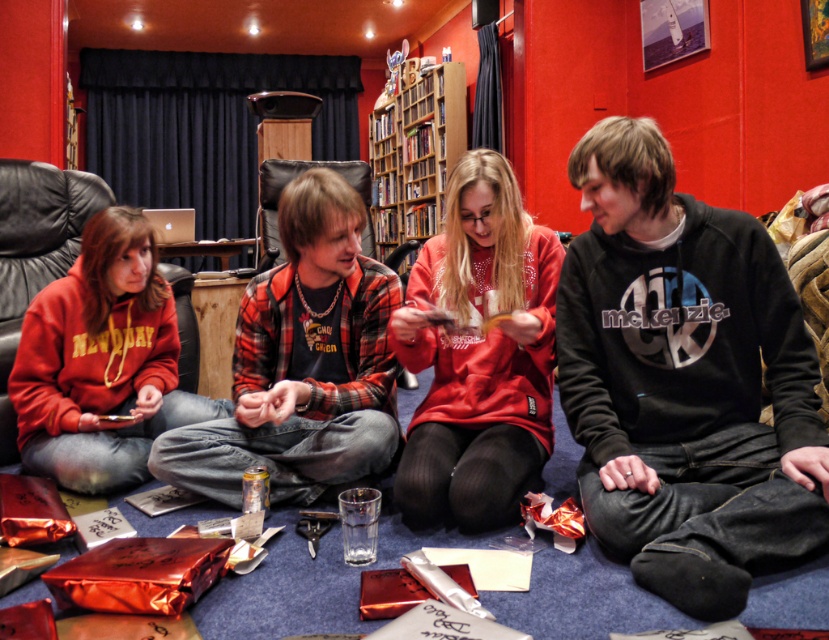
Question: Which point is closer to the camera?

Choices:
 (A) (74, 208)
 (B) (604, 365)

Answer: (B)

Question: Does black cotton hoodie at center appear on the left side of flannel shirt at center?

Choices:
 (A) no
 (B) yes

Answer: (A)

Question: Is matte red hoodie at center bigger than wooden bookshelf at upper center?

Choices:
 (A) no
 (B) yes

Answer: (A)

Question: Which of the following is the closest to the observer?

Choices:
 (A) black cotton hoodie at center
 (B) flannel shirt at center
 (C) black leather armchair at left
 (D) matte red hoodie at center

Answer: (A)

Question: Which point is farther from the camera taking this photo?

Choices:
 (A) (794, 554)
 (B) (259, 417)

Answer: (B)

Question: Considering the relative positions of flannel shirt at center and matte red hoodie at center in the image provided, where is flannel shirt at center located with respect to matte red hoodie at center?

Choices:
 (A) above
 (B) below

Answer: (B)